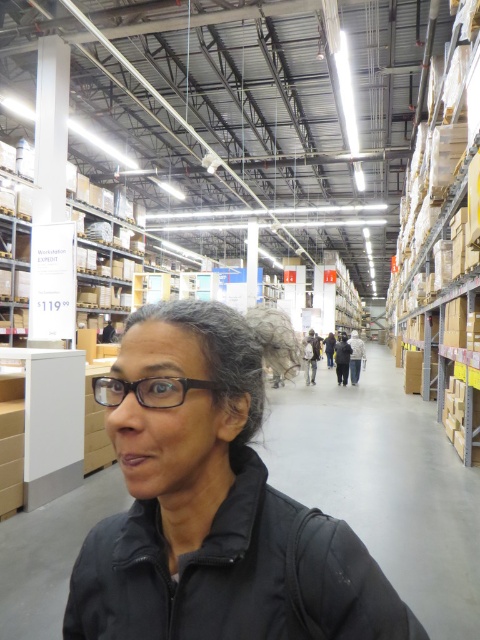
Can you confirm if brown cardboard boxes at right is positioned below gray matte hair at center?

Incorrect, brown cardboard boxes at right is not positioned below gray matte hair at center.

This screenshot has width=480, height=640. What are the coordinates of `brown cardboard boxes at right` in the screenshot? It's located at (444, 236).

Image resolution: width=480 pixels, height=640 pixels. I want to click on brown cardboard boxes at right, so click(x=444, y=236).

Does black matte jacket at lower left come in front of gray matte hair at center?

Yes, black matte jacket at lower left is closer to the viewer.

Between black matte jacket at lower left and gray matte hair at center, which one has more height?

black matte jacket at lower left

Which is behind, point (215, 556) or point (236, 371)?

The point (236, 371) is behind.

Locate an element on the screen. black matte jacket at lower left is located at coordinates (233, 573).

Is black matte jacket at lower left above brown cardboard boxes at right?

No.

Is black matte jacket at lower left shorter than brown cardboard boxes at right?

Indeed, black matte jacket at lower left has a lesser height compared to brown cardboard boxes at right.

Which is behind, point (287, 536) or point (458, 452)?

Point (458, 452)

Where is `black matte jacket at lower left`? The height and width of the screenshot is (640, 480). black matte jacket at lower left is located at coordinates (233, 573).